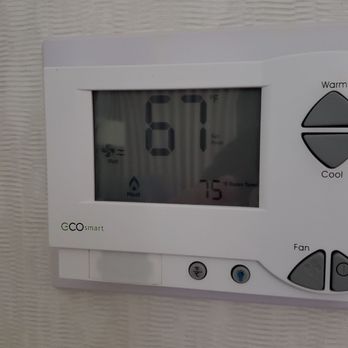
Where is `screen`? The width and height of the screenshot is (348, 348). screen is located at coordinates (177, 168), (125, 127), (156, 141), (134, 180).